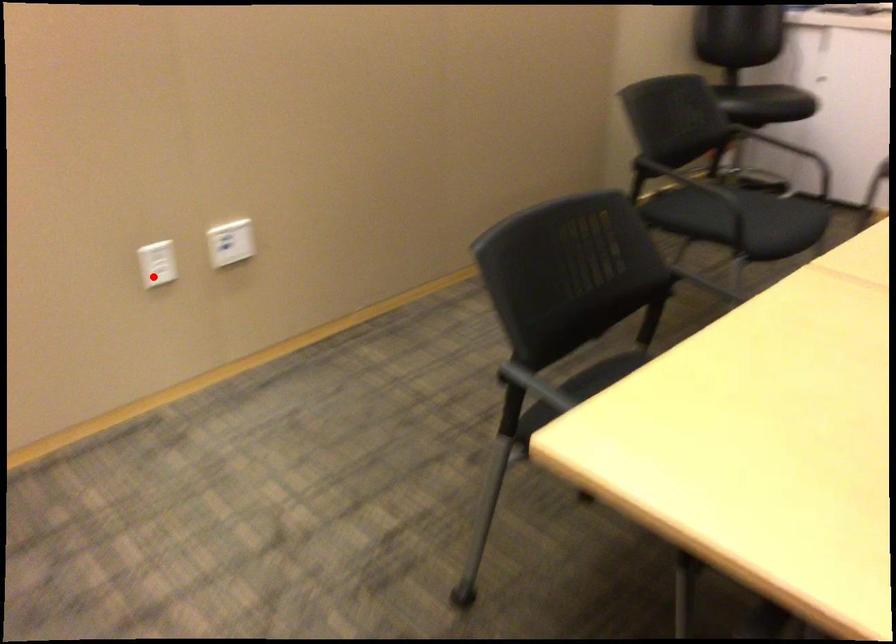
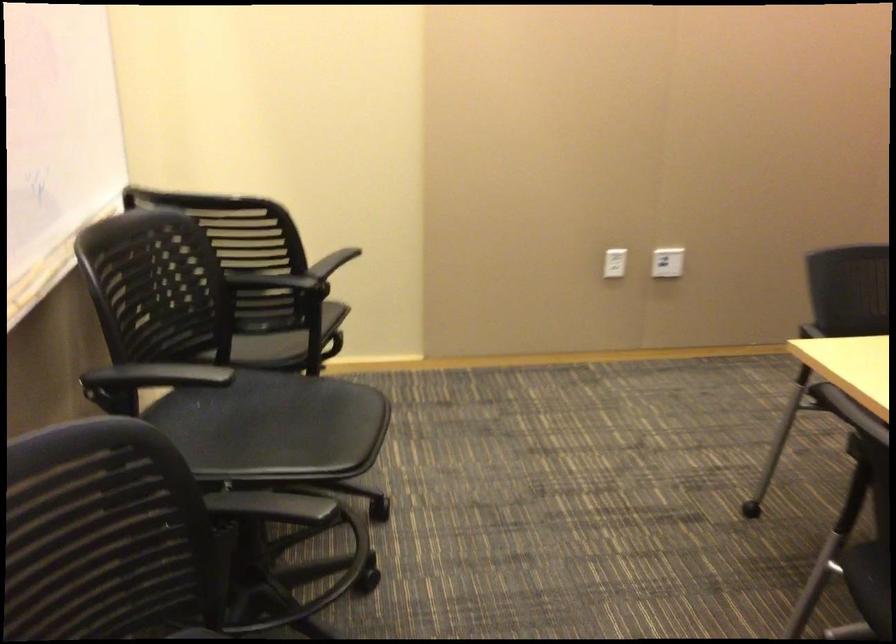
Question: I am providing you with two images of the same scene from different viewpoints. Given a red point in image1, look at the same physical point in image2. Is it:

Choices:
 (A) Closer to the viewpoint
 (B) Farther from the viewpoint

Answer: (B)